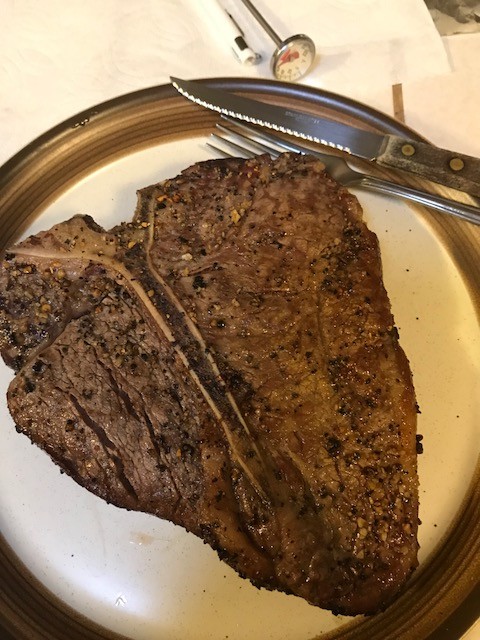
You are a GUI agent. You are given a task and a screenshot of the screen. Output one action in this format:
    pyautogui.click(x=<x>, y=<y>)
    Task: Click on the plate right of steak
    This screenshot has width=480, height=640.
    Given the screenshot: What is the action you would take?
    pyautogui.click(x=442, y=312)